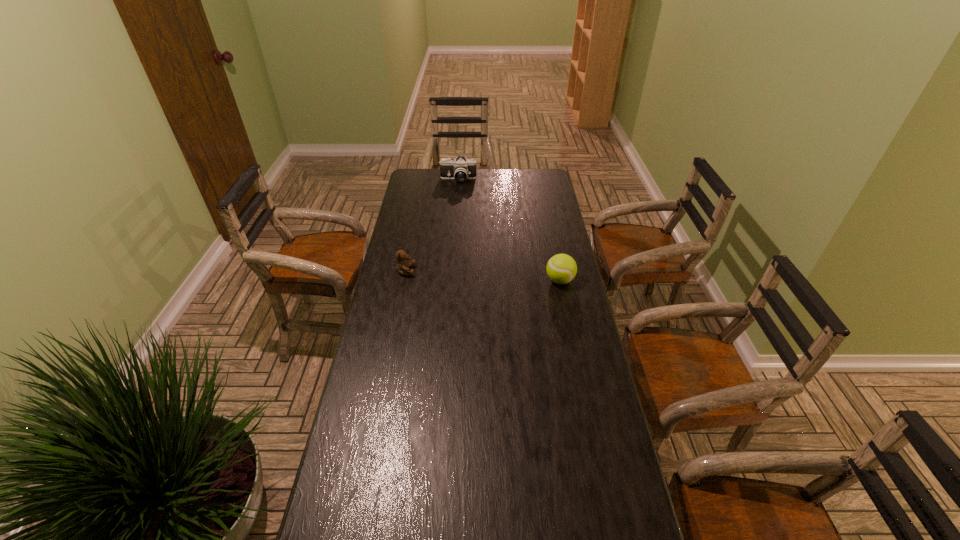
In order to click on vacant region that satisfies the following two spatial constraints: 1. on the front side of the farthest object; 2. on the front-facing side of the teddy bear in this screenshot , I will do `click(451, 271)`.